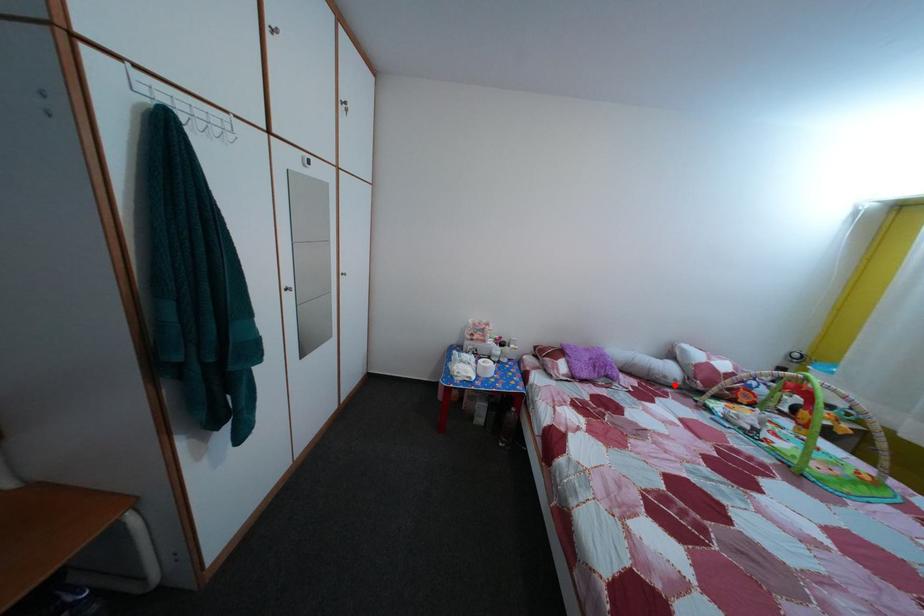
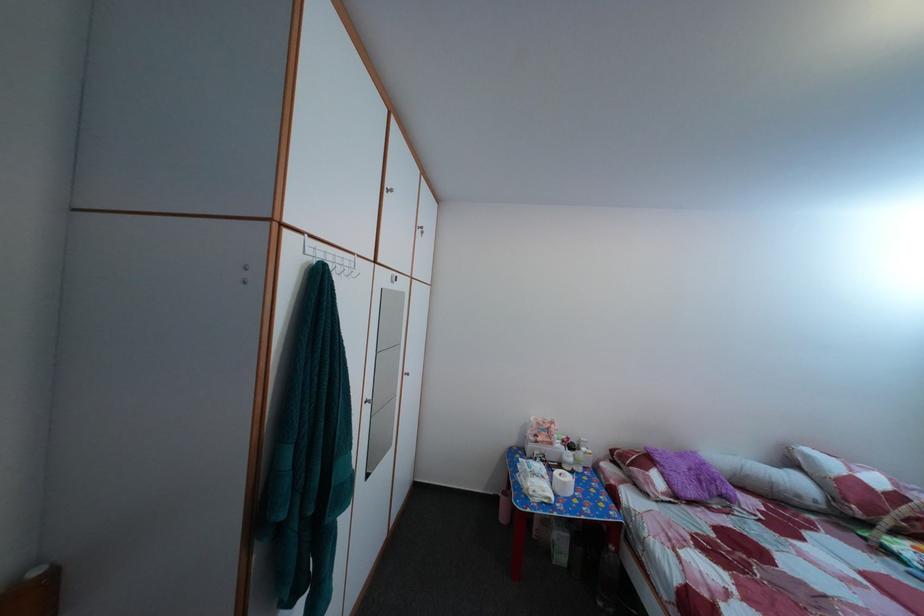
Question: I am providing you with two images of the same scene from different viewpoints. A red point is shown in image1. For the corresponding object point in image2, is it positioned nearer or farther from the camera?

Choices:
 (A) Nearer
 (B) Farther

Answer: (A)